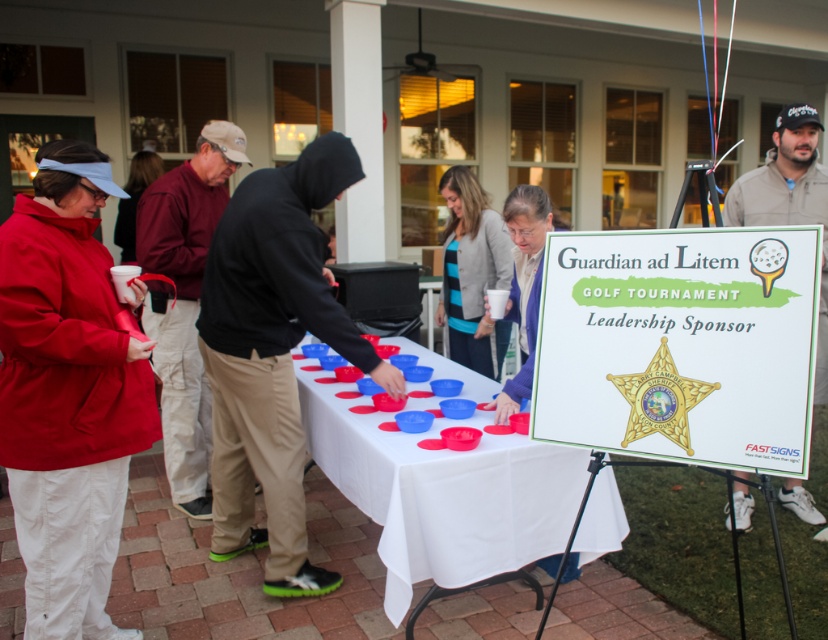
You are standing at the center of the image. Which object from the following list is located at the coordinates point (66, 394)? The objects are red nylon jacket at left, small red plastic bowl at center, blue plastic bowl at right.

The red nylon jacket at left is located at point (66, 394).

You are organizing a charity event and need to place a 1.2 meter wide banner between the red nylon jacket at left and the khaki pants at center. Based on their widths, will the banner fit between them?

The red nylon jacket at left has a lesser width compared to khaki pants at center. The total width of both objects combined is not provided, but the banner requires 1.2 meters. Without knowing the exact widths, it is impossible to determine if the banner will fit. Please measure the space between them first.